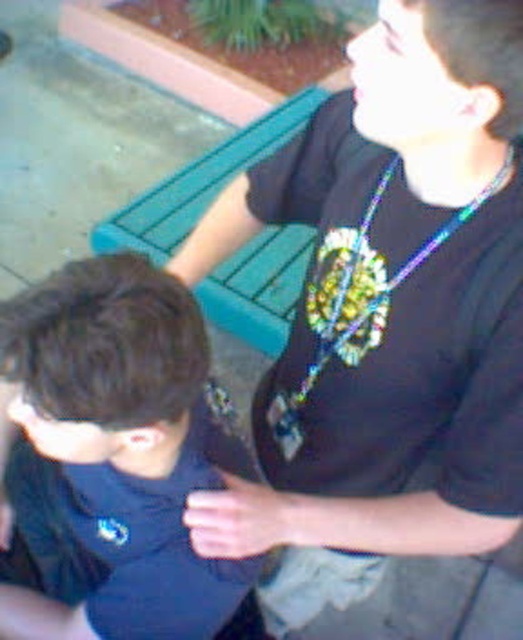
Who is more forward, (141, 477) or (285, 260)?

Point (141, 477) is in front.

Where is `dark blue fabric at lower left`? This screenshot has width=523, height=640. dark blue fabric at lower left is located at coordinates (119, 448).

Which of these two, dark blue fabric at lower left or holographic plastic necklace at center, stands shorter?

holographic plastic necklace at center is shorter.

Can you confirm if dark blue fabric at lower left is positioned to the left of holographic plastic necklace at center?

Yes, dark blue fabric at lower left is to the left of holographic plastic necklace at center.

Which is in front, point (121, 580) or point (367, 344)?

Point (367, 344) is more forward.

Where is `dark blue fabric at lower left`? This screenshot has width=523, height=640. dark blue fabric at lower left is located at coordinates (119, 448).

Who is positioned more to the left, black matte shirt at upper right or holographic plastic necklace at center?

Positioned to the left is black matte shirt at upper right.

Between point (305, 156) and point (475, 211), which one is positioned in front?

Point (475, 211)

I want to click on black matte shirt at upper right, so click(386, 312).